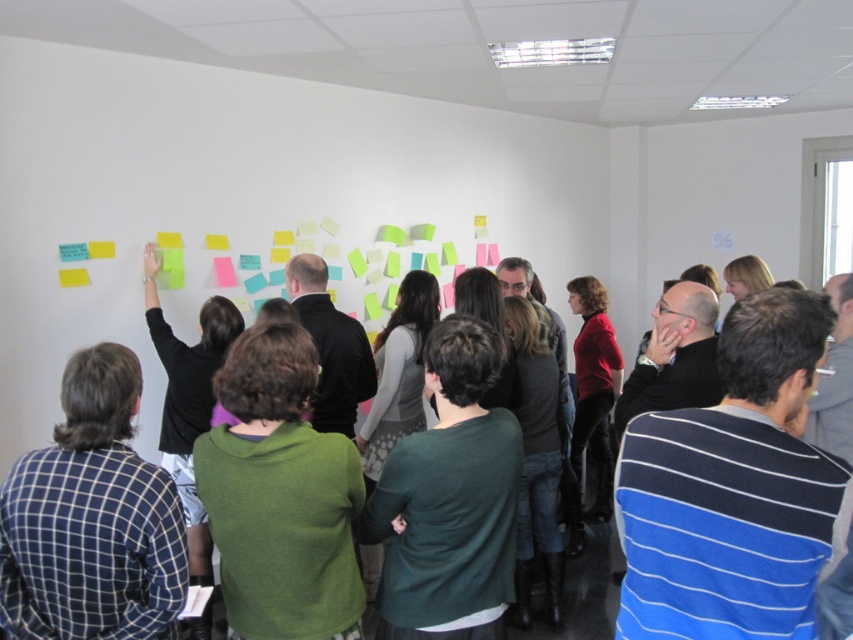
You are standing in the office and see a point marked at coordinates (x=91, y=518). What object or person is located at that point?

The point at coordinates (x=91, y=518) corresponds to the blue checkered shirt at left.

You are a participant in the meeting and want to hand a document to the person wearing the blue checkered shirt at left. The document is on the yellow paper at upper left. Can you directly hand it to them without moving around?

The blue checkered shirt at left is closer to the viewer than the yellow paper at upper left, so the person wearing the blue checkered shirt at left is physically nearer to you. Therefore, you can directly hand the document from the yellow paper at upper left to them without needing to move around.

You are standing in the room and want to hand a document to both the person wearing the blue checkered shirt at left and the person in the green sweater at center. Which person should you approach first to ensure you can reach them without walking past the other?

You should approach the blue checkered shirt at left first because it is closer to you than the green sweater at center, so you can reach them without needing to walk past the other person.